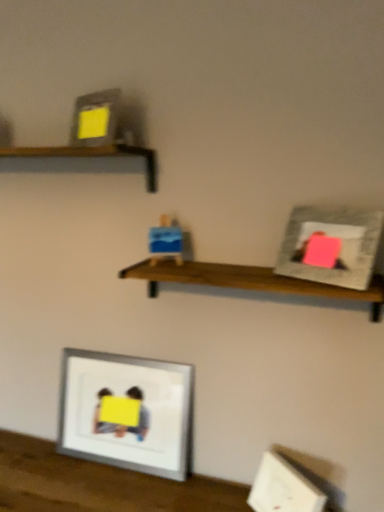
Find the location of a particular element. This screenshot has width=384, height=512. free area below wooden shelf at center, which is the 2th shelf in top-to-bottom order (from a real-world perspective) is located at coordinates (208, 494).